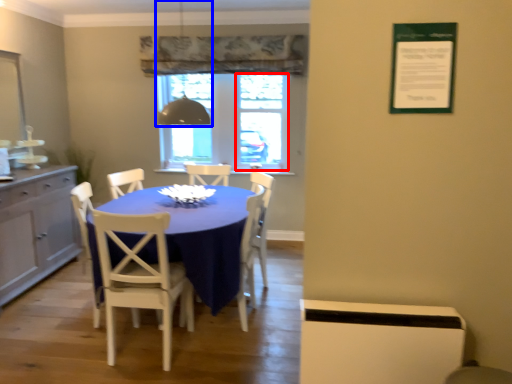
Question: Which object is closer to the camera taking this photo, window screen (highlighted by a red box) or light fixture (highlighted by a blue box)?

Choices:
 (A) window screen
 (B) light fixture

Answer: (B)